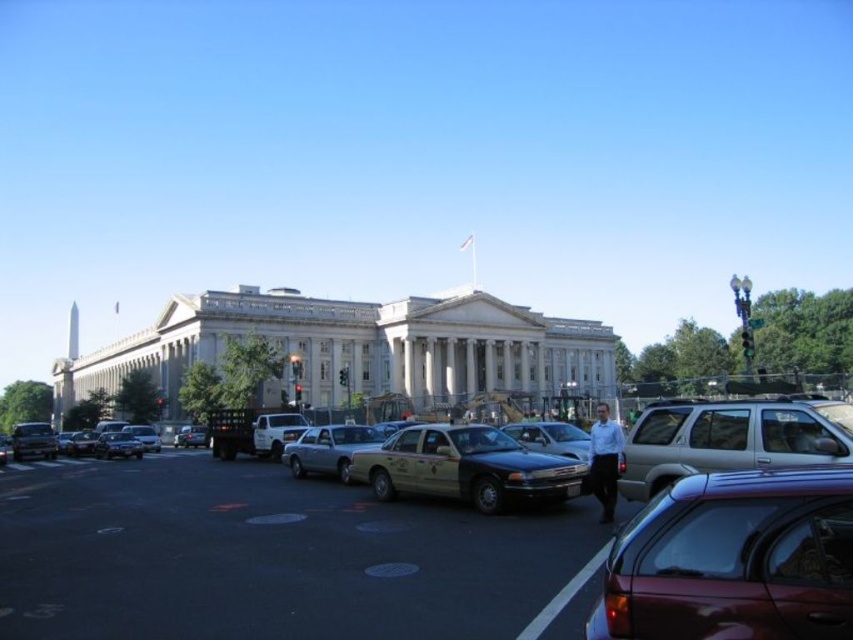
Question: Does black asphalt parking lot at center appear over yellow matte taxi cab at center?

Choices:
 (A) no
 (B) yes

Answer: (A)

Question: Among these points, which one is nearest to the camera?

Choices:
 (A) (488, 449)
 (B) (370, 624)

Answer: (B)

Question: Which point is farther to the camera?

Choices:
 (A) shiny maroon sedan at lower right
 (B) yellow matte taxi cab at center
 (C) black asphalt parking lot at center

Answer: (B)

Question: Can you confirm if yellow matte taxi cab at center is positioned above silver metallic taxi at center?

Choices:
 (A) no
 (B) yes

Answer: (B)

Question: Estimate the real-world distances between objects in this image. Which object is farther from the silver metallic taxi at center?

Choices:
 (A) black asphalt parking lot at center
 (B) shiny maroon sedan at lower right
 (C) metallic silver suv at lower right
 (D) yellow matte taxi cab at center

Answer: (B)

Question: Does black asphalt parking lot at center have a lesser width compared to silver metallic taxi at center?

Choices:
 (A) yes
 (B) no

Answer: (B)